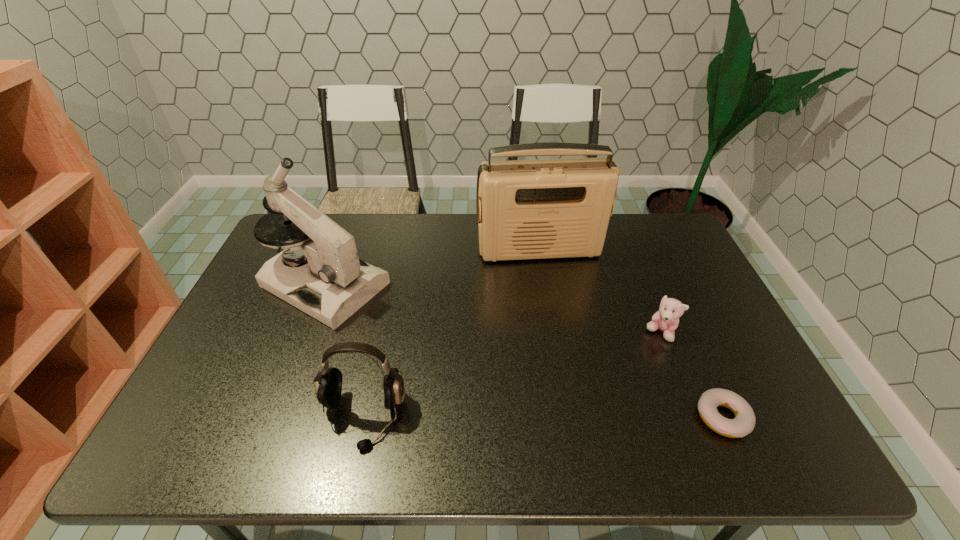
The width and height of the screenshot is (960, 540). Find the location of `free spot between the third shortest object and the shortest object`. free spot between the third shortest object and the shortest object is located at coordinates (542, 417).

You are a GUI agent. You are given a task and a screenshot of the screen. Output one action in this format:
    pyautogui.click(x=<x>, y=<y>)
    Task: Click on the vacant space in between the radio receiver and the third shortest object
    This screenshot has width=960, height=540.
    Given the screenshot: What is the action you would take?
    pyautogui.click(x=451, y=334)

The height and width of the screenshot is (540, 960). What are the coordinates of `unoccupied area between the third object from left to right and the doughnut` in the screenshot? It's located at (631, 334).

You are a GUI agent. You are given a task and a screenshot of the screen. Output one action in this format:
    pyautogui.click(x=<x>, y=<y>)
    Task: Click on the free space between the radio receiver and the doughnut
    The height and width of the screenshot is (540, 960).
    Given the screenshot: What is the action you would take?
    pyautogui.click(x=631, y=334)

Where is `vacant region between the doughnut and the fourth tallest object`? The height and width of the screenshot is (540, 960). vacant region between the doughnut and the fourth tallest object is located at coordinates (691, 375).

Select which object appears as the third closest to the third object from right to left. Please provide its 2D coordinates. Your answer should be formatted as a tuple, i.e. [(x, y)], where the tuple contains the x and y coordinates of a point satisfying the conditions above.

[(328, 387)]

This screenshot has width=960, height=540. Identify the location of object that is the third closest one to the microscope. (666, 319).